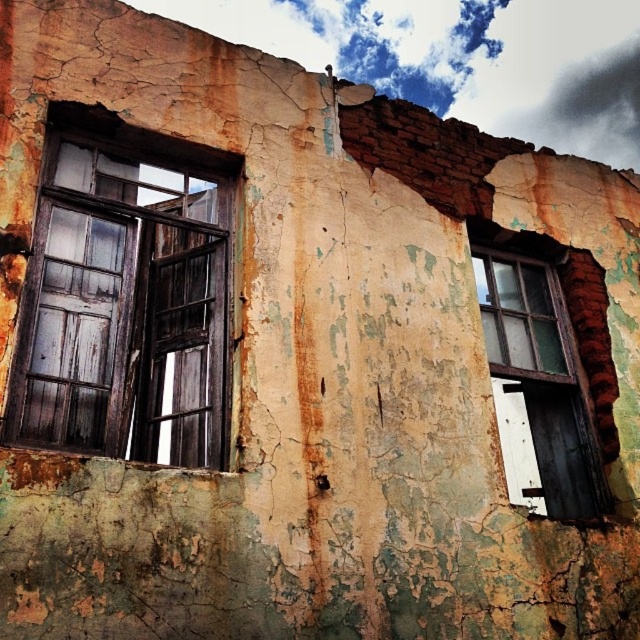
You are a painter who needs to place a ladder between the wooden window at left and the wooden window at right. The ladder is 8 feet wide. Will the ladder fit between the two windows?

The wooden window at left and wooden window at right are 9.50 feet apart from each other. Since the ladder is 8 feet wide, it will fit between them with 1.5 feet of space remaining.